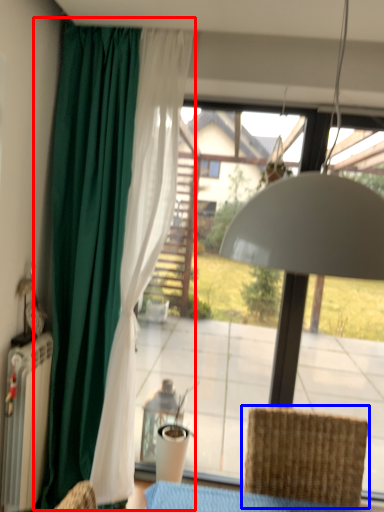
Question: Which of the following is the closest to the observer, curtain (highlighted by a red box) or chair (highlighted by a blue box)?

Choices:
 (A) curtain
 (B) chair

Answer: (B)